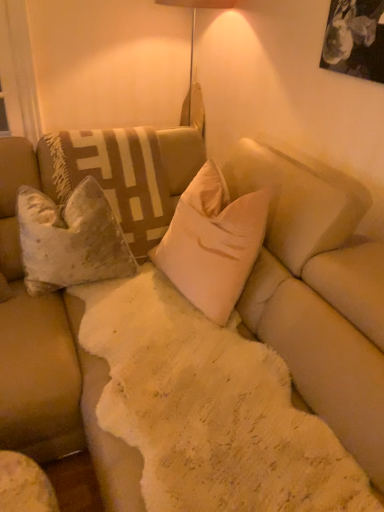
Question: From a real-world perspective, does beige velvet pillow at center, placed as the second pillow when sorted from left to right, sit lower than velvet beige pillow at left, the first pillow positioned from the left?

Choices:
 (A) yes
 (B) no

Answer: (B)

Question: Is beige velvet pillow at center, the first pillow from the right, wider than velvet beige pillow at left, the first pillow positioned from the left?

Choices:
 (A) yes
 (B) no

Answer: (B)

Question: Can you confirm if beige velvet pillow at center, placed as the second pillow when sorted from left to right, is bigger than velvet beige pillow at left, which is the second pillow from right to left?

Choices:
 (A) no
 (B) yes

Answer: (B)

Question: Can you confirm if beige velvet pillow at center, placed as the second pillow when sorted from left to right, is positioned to the left of velvet beige pillow at left, which is the second pillow from right to left?

Choices:
 (A) no
 (B) yes

Answer: (A)

Question: From the image's perspective, is beige velvet pillow at center, placed as the second pillow when sorted from left to right, above velvet beige pillow at left, the first pillow positioned from the left?

Choices:
 (A) yes
 (B) no

Answer: (B)

Question: From a real-world perspective, is beige velvet pillow at center, the first pillow from the right, on top of velvet beige pillow at left, the first pillow positioned from the left?

Choices:
 (A) no
 (B) yes

Answer: (B)

Question: Is velvet beige pillow at left, the first pillow positioned from the left, closer to the viewer compared to beige velvet pillow at center, placed as the second pillow when sorted from left to right?

Choices:
 (A) no
 (B) yes

Answer: (A)

Question: From the image's perspective, would you say velvet beige pillow at left, the first pillow positioned from the left, is shown under beige velvet pillow at center, the first pillow from the right?

Choices:
 (A) yes
 (B) no

Answer: (B)

Question: Is velvet beige pillow at left, which is the second pillow from right to left, facing towards beige velvet pillow at center, placed as the second pillow when sorted from left to right?

Choices:
 (A) yes
 (B) no

Answer: (B)

Question: Is velvet beige pillow at left, the first pillow positioned from the left, oriented away from beige velvet pillow at center, the first pillow from the right?

Choices:
 (A) yes
 (B) no

Answer: (B)

Question: Does velvet beige pillow at left, the first pillow positioned from the left, have a smaller size compared to beige velvet pillow at center, the first pillow from the right?

Choices:
 (A) no
 (B) yes

Answer: (B)

Question: Considering the relative sizes of velvet beige pillow at left, the first pillow positioned from the left, and beige velvet pillow at center, the first pillow from the right, in the image provided, is velvet beige pillow at left, the first pillow positioned from the left, taller than beige velvet pillow at center, the first pillow from the right,?

Choices:
 (A) yes
 (B) no

Answer: (B)

Question: From the image's perspective, is beige velvet pillow at center, placed as the second pillow when sorted from left to right, positioned above or below velvet beige pillow at left, which is the second pillow from right to left?

Choices:
 (A) above
 (B) below

Answer: (B)